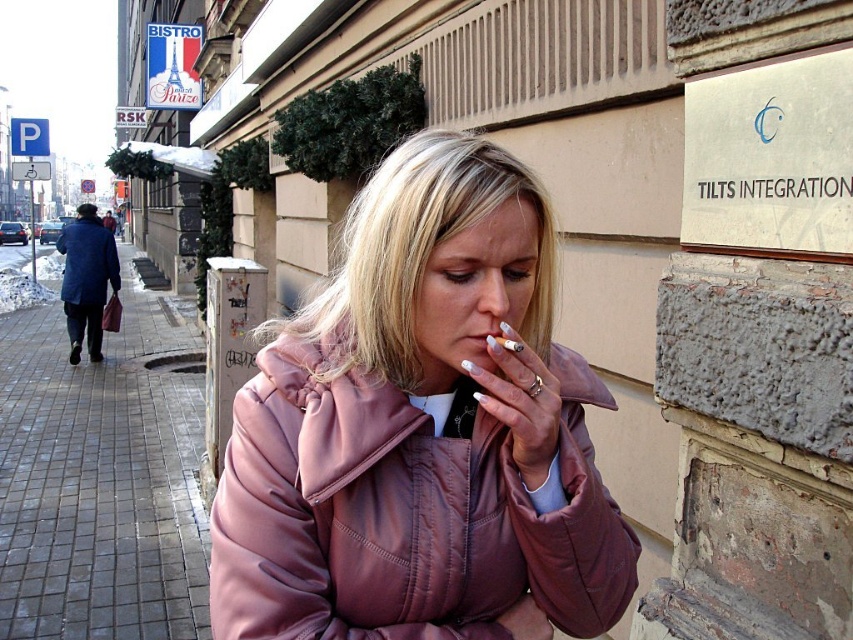
Between gray brick pavement at lower left and white matte cigarette at center, which one has more height?

With more height is gray brick pavement at lower left.

Does gray brick pavement at lower left have a larger size compared to white matte cigarette at center?

Yes.

Locate an element on the screen. This screenshot has height=640, width=853. gray brick pavement at lower left is located at coordinates (102, 477).

Which is in front, point (36, 376) or point (112, 256)?

Point (36, 376) is in front.

Who is shorter, gray brick pavement at lower left or blue wool coat at left?

With less height is blue wool coat at left.

Between point (28, 387) and point (86, 225), which one is positioned behind?

The point (86, 225) is behind.

Locate an element on the screen. The width and height of the screenshot is (853, 640). gray brick pavement at lower left is located at coordinates (102, 477).

Looking at this image, does blue wool coat at left appear on the right side of white matte cigarette at center?

No, blue wool coat at left is not to the right of white matte cigarette at center.

Between blue wool coat at left and white matte cigarette at center, which one is positioned lower?

white matte cigarette at center

Is point (82, 288) positioned after point (498, 337)?

Yes, it is behind point (498, 337).

You are a GUI agent. You are given a task and a screenshot of the screen. Output one action in this format:
    pyautogui.click(x=<x>, y=<y>)
    Task: Click on the blue wool coat at left
    The image size is (853, 640).
    Given the screenshot: What is the action you would take?
    pyautogui.click(x=86, y=260)